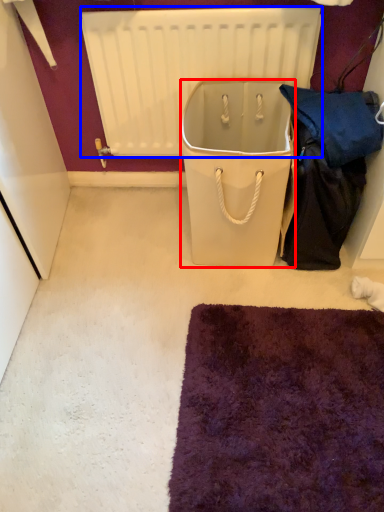
Question: Which of the following is the closest to the observer, cooler (highlighted by a red box) or radiator (highlighted by a blue box)?

Choices:
 (A) cooler
 (B) radiator

Answer: (A)